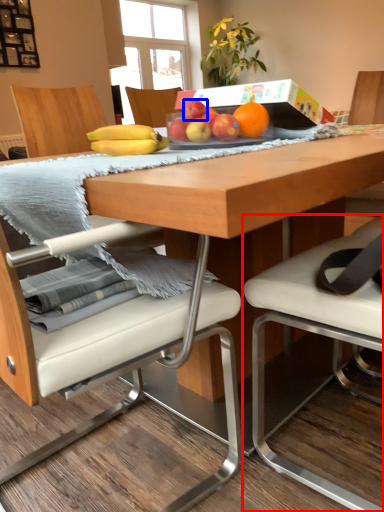
Question: Which object is closer to the camera taking this photo, chair (highlighted by a red box) or apple (highlighted by a blue box)?

Choices:
 (A) chair
 (B) apple

Answer: (A)